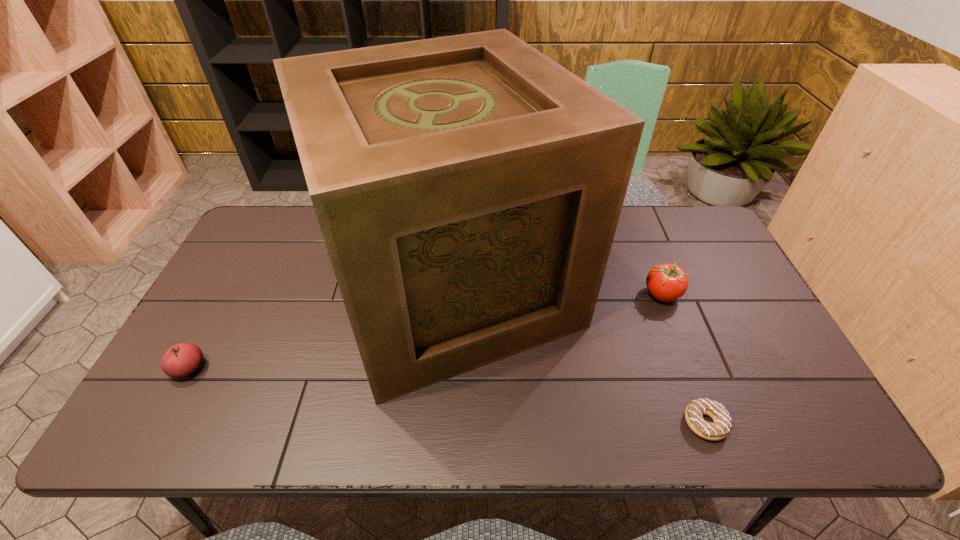
Identify the location of vacant space that satisfies the following two spatial constraints: 1. on the front side of the shortest object; 2. on the right side of the tallest object. The height and width of the screenshot is (540, 960). (441, 423).